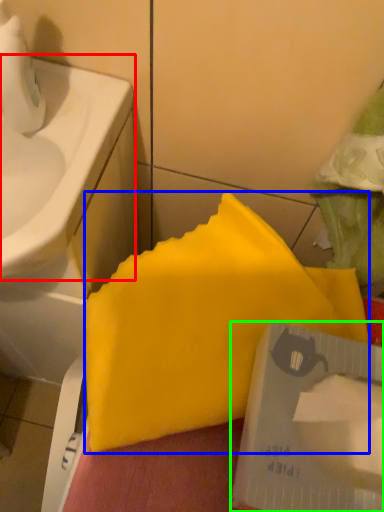
Question: Which object is the closest to the sink (highlighted by a red box)? Choose among these: waste (highlighted by a blue box) or writing (highlighted by a green box).

Choices:
 (A) waste
 (B) writing

Answer: (A)